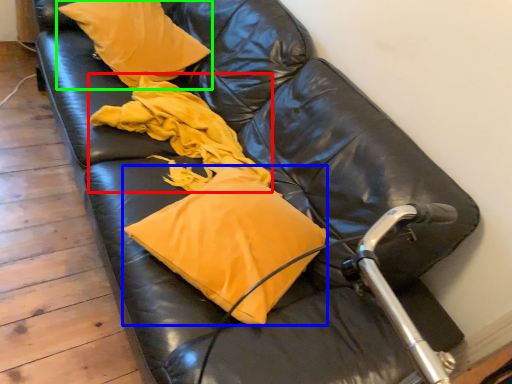
Question: Which is nearer to the material (highlighted by a red box)? pillow (highlighted by a blue box) or pillow (highlighted by a green box).

Choices:
 (A) pillow
 (B) pillow

Answer: (B)